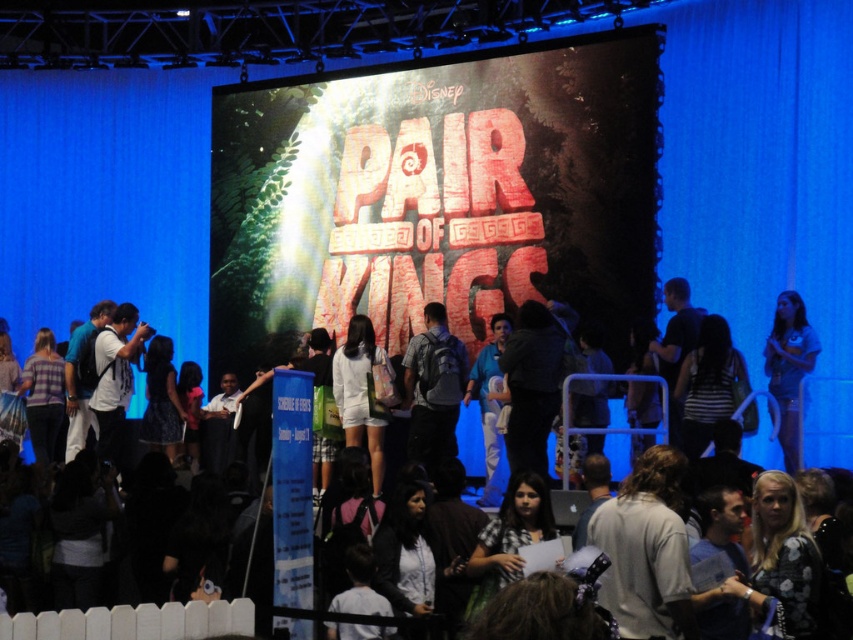
Question: Is light blue denim shorts at right closer to the viewer compared to blue fabric shirt at center?

Choices:
 (A) no
 (B) yes

Answer: (B)

Question: Which point is closer to the camera?

Choices:
 (A) (126, 310)
 (B) (267, 125)
 (C) (527, 314)
 (D) (786, 449)

Answer: (D)

Question: Estimate the real-world distances between objects in this image. Which object is closer to the blue fabric shirt at center?

Choices:
 (A) blonde hair at center
 (B) matte gray backpack at center
 (C) plaid shirt at center

Answer: (B)

Question: Is matte gray backpack at center bigger than white matte shirt at left?

Choices:
 (A) no
 (B) yes

Answer: (A)

Question: Is blonde hair at center to the right of dark fabric coat at center from the viewer's perspective?

Choices:
 (A) no
 (B) yes

Answer: (B)

Question: Which of the following is the farthest from the observer?

Choices:
 (A) light blue denim shorts at right
 (B) blue fabric shirt at center

Answer: (B)